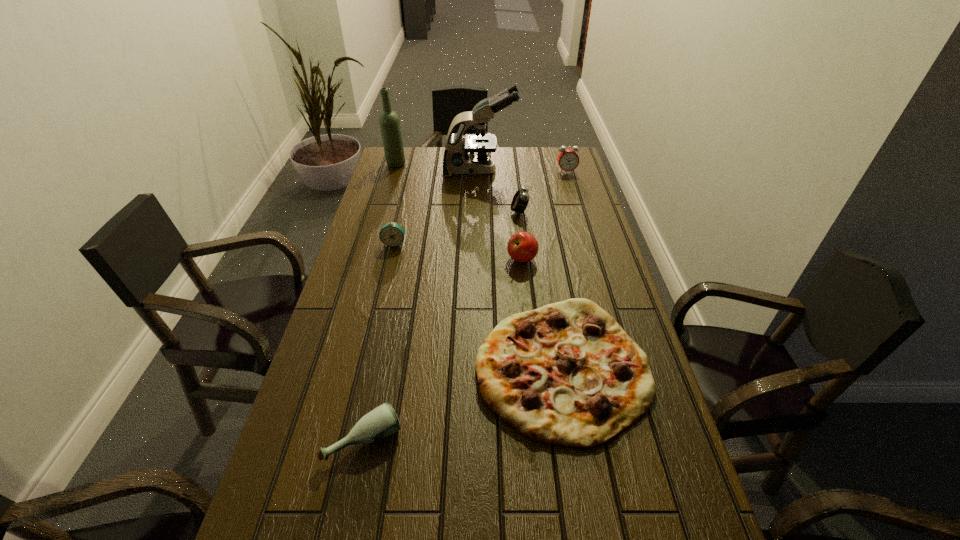
The width and height of the screenshot is (960, 540). Identify the location of free space that satisfies the following two spatial constraints: 1. on the face of the second alarm clock from left to right; 2. on the front-facing side of the fifth farthest object. (523, 244).

Identify the location of vacant space that satisfies the following two spatial constraints: 1. on the back side of the apple; 2. through the eyepieces of the microscope. (512, 171).

Identify the location of free point that satisfies the following two spatial constraints: 1. on the face of the fifth nearest object; 2. on the front-facing side of the leftmost alarm clock. This screenshot has width=960, height=540. (523, 244).